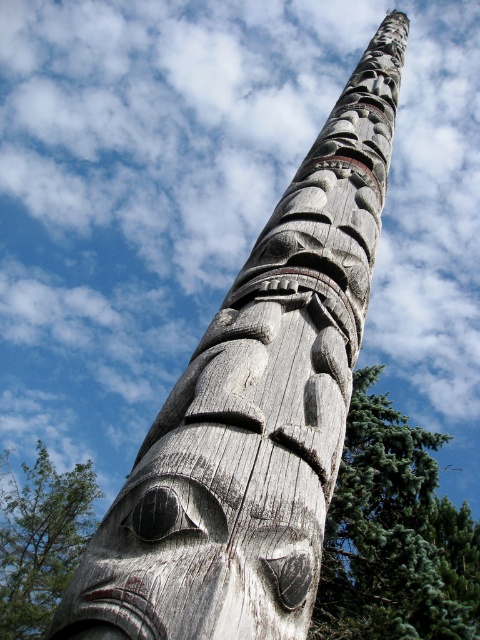
You are standing in front of a tall wooden totem pole surrounded by trees. You notice a point marked at coordinates (394, 534). Which object from the scene does this point belong to?

The point at coordinates (394, 534) is on the green needle like tree at center.

You are standing in front of the totem pole and notice two points marked on its surface. One is labeled as point (x=370, y=561) and the other as point (x=373, y=452). Which point is closer to you?

Point (x=370, y=561) is in front of point (x=373, y=452), so it is closer to you.